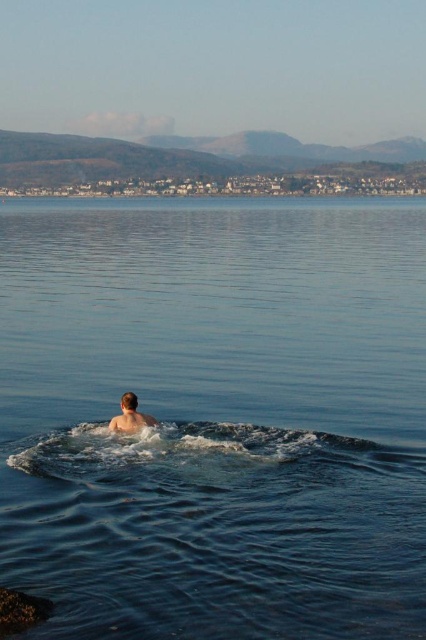
You are a lifeguard on duty and need to assess the distance between the clear blue water at center and the light brown skin at center. Based on the scene, can you confirm if the distance is more than 30 meters?

The clear blue water at center and light brown skin at center are 29.39 meters apart, so the distance is less than 30 meters.

You are a photographer trying to capture the swimmer in the image. Since you want to focus on the swimmer, which object should you zoom in on more, the clear blue water at center or the light brown skin at center?

You should zoom in more on the light brown skin at center because it is narrower than the clear blue water at center, making it easier to focus on the swimmer.